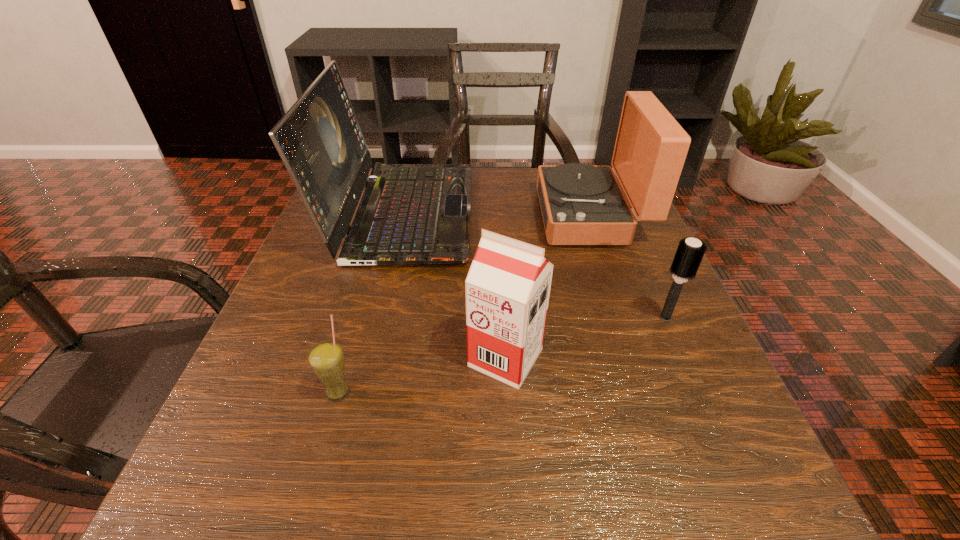
Locate an element on the screen. The height and width of the screenshot is (540, 960). free space at the far edge of the desktop is located at coordinates (496, 168).

Find the location of a particular element. The width and height of the screenshot is (960, 540). vacant space at the near edge of the desktop is located at coordinates (453, 485).

Identify the location of free region at the left edge of the desktop. (296, 404).

Where is `vacant region at the right edge of the desktop`? vacant region at the right edge of the desktop is located at coordinates (617, 251).

Locate an element on the screen. This screenshot has height=540, width=960. vacant space at the near left corner of the desktop is located at coordinates (273, 505).

In the image, there is a desktop. Identify the location of vacant space at the near right corner. Image resolution: width=960 pixels, height=540 pixels. (764, 523).

At what (x,y) coordinates should I click in order to perform the action: click on vacant space that's between the third object from right to left and the third farthest object. Please return your answer as a coordinate pair (x, y). This screenshot has height=540, width=960. Looking at the image, I should click on (586, 338).

Locate an element on the screen. The width and height of the screenshot is (960, 540). free point between the third nearest object and the phonograph record is located at coordinates (628, 266).

The height and width of the screenshot is (540, 960). What are the coordinates of `vacant area between the phonograph record and the shortest object` in the screenshot? It's located at (465, 303).

Where is `free spot between the laptop computer and the phonograph record`? free spot between the laptop computer and the phonograph record is located at coordinates (497, 214).